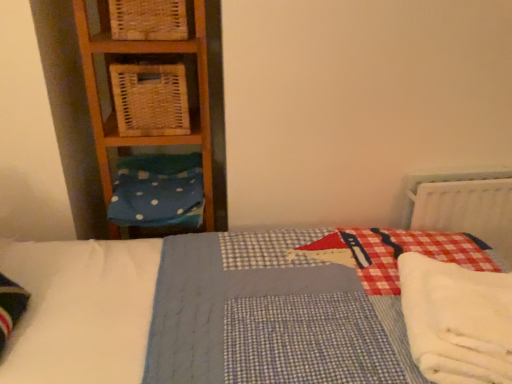
You are a GUI agent. You are given a task and a screenshot of the screen. Output one action in this format:
    pyautogui.click(x=<x>, y=<y>)
    Task: Click on the woven wood crate at upper left, acting as the 1th crate starting from the top
    
    Given the screenshot: What is the action you would take?
    pyautogui.click(x=148, y=19)

Measure the distance between woven wood crate at upper left, arranged as the 2th crate when ordered from the bottom, and camera.

woven wood crate at upper left, arranged as the 2th crate when ordered from the bottom, and camera are 4.09 feet apart from each other.

This screenshot has width=512, height=384. What are the coordinates of `blue polka dot fabric at left` in the screenshot? It's located at (157, 199).

From the image's perspective, who appears lower, blue polka dot fabric at left or woven wood basket at left, the second crate in the top-to-bottom sequence?

blue polka dot fabric at left is shown below in the image.

From a real-world perspective, which is physically above, blue polka dot fabric at left or woven wood basket at left, the second crate in the top-to-bottom sequence?

In real-world perspective, woven wood basket at left, the second crate in the top-to-bottom sequence, is above.

Between blue polka dot fabric at left and woven wood basket at left, the second crate in the top-to-bottom sequence, which one has less height?

With less height is blue polka dot fabric at left.

Do you think blue polka dot fabric at left is within woven wood basket at left, the second crate in the top-to-bottom sequence, or outside of it?

blue polka dot fabric at left is outside woven wood basket at left, the second crate in the top-to-bottom sequence.

From the picture: Does woven wood basket at left, the second crate in the top-to-bottom sequence, turn towards white fluffy blanket at lower right?

No, woven wood basket at left, the second crate in the top-to-bottom sequence, is not oriented towards white fluffy blanket at lower right.

Which is behind, point (176, 122) or point (509, 316)?

Positioned behind is point (176, 122).

Measure the distance between woven wood basket at left, the 1th crate in the bottom-to-top sequence, and white fluffy blanket at lower right.

They are 36.78 inches apart.

Between woven wood basket at left, the 1th crate in the bottom-to-top sequence, and white fluffy blanket at lower right, which one has more height?

woven wood basket at left, the 1th crate in the bottom-to-top sequence, is taller.

What are the coordinates of `material below the blue polka dot fabric at left (from the image's perspective)` in the screenshot? It's located at (457, 320).

Can you confirm if white fluffy blanket at lower right is thinner than blue polka dot fabric at left?

Indeed, white fluffy blanket at lower right has a lesser width compared to blue polka dot fabric at left.

Considering the relative positions of white fluffy blanket at lower right and blue polka dot fabric at left in the image provided, is white fluffy blanket at lower right in front of blue polka dot fabric at left?

Yes.

How different are the orientations of white fluffy blanket at lower right and blue polka dot fabric at left in degrees?

68.8 degrees separate the facing orientations of white fluffy blanket at lower right and blue polka dot fabric at left.

Is white fluffy blanket at lower right taller or shorter than woven wood crate at upper left, acting as the 1th crate starting from the top?

Clearly, white fluffy blanket at lower right is shorter compared to woven wood crate at upper left, acting as the 1th crate starting from the top.

From the picture: Would you say white fluffy blanket at lower right contains woven wood crate at upper left, arranged as the 2th crate when ordered from the bottom?

No, woven wood crate at upper left, arranged as the 2th crate when ordered from the bottom, is not a part of white fluffy blanket at lower right.

Where is `material in front of the woven wood crate at upper left, arranged as the 2th crate when ordered from the bottom`? The width and height of the screenshot is (512, 384). material in front of the woven wood crate at upper left, arranged as the 2th crate when ordered from the bottom is located at coordinates (457, 320).

Is the position of white fluffy blanket at lower right more distant than that of woven wood crate at upper left, acting as the 1th crate starting from the top?

No, white fluffy blanket at lower right is closer to the camera.

Is woven wood crate at upper left, acting as the 1th crate starting from the top, with blue polka dot fabric at left?

woven wood crate at upper left, acting as the 1th crate starting from the top, and blue polka dot fabric at left are not in contact.

Looking at their sizes, would you say woven wood crate at upper left, acting as the 1th crate starting from the top, is wider or thinner than blue polka dot fabric at left?

In the image, woven wood crate at upper left, acting as the 1th crate starting from the top, appears to be more narrow than blue polka dot fabric at left.

In the scene shown: From the image's perspective, who appears lower, white fluffy blanket at lower right or woven wood basket at left, the second crate in the top-to-bottom sequence?

white fluffy blanket at lower right, from the image's perspective.

Would you say white fluffy blanket at lower right is outside woven wood basket at left, the 1th crate in the bottom-to-top sequence?

That's correct, white fluffy blanket at lower right is outside of woven wood basket at left, the 1th crate in the bottom-to-top sequence.

Can you tell me how much white fluffy blanket at lower right and woven wood basket at left, the 1th crate in the bottom-to-top sequence, differ in facing direction?

There is a 70.4-degree angle between the facing directions of white fluffy blanket at lower right and woven wood basket at left, the 1th crate in the bottom-to-top sequence.

From a real-world perspective, which is physically above, white fluffy blanket at lower right or woven wood basket at left, the 1th crate in the bottom-to-top sequence?

woven wood basket at left, the 1th crate in the bottom-to-top sequence, from a real-world perspective.

Considering the relative positions of woven wood basket at left, the second crate in the top-to-bottom sequence, and woven wood crate at upper left, arranged as the 2th crate when ordered from the bottom, in the image provided, is woven wood basket at left, the second crate in the top-to-bottom sequence, to the left or to the right of woven wood crate at upper left, arranged as the 2th crate when ordered from the bottom,?

From the image, it's evident that woven wood basket at left, the second crate in the top-to-bottom sequence, is to the left of woven wood crate at upper left, arranged as the 2th crate when ordered from the bottom.

From a real-world perspective, between woven wood basket at left, the 1th crate in the bottom-to-top sequence, and woven wood crate at upper left, arranged as the 2th crate when ordered from the bottom, who is vertically higher?

woven wood crate at upper left, arranged as the 2th crate when ordered from the bottom, from a real-world perspective.

Is woven wood basket at left, the 1th crate in the bottom-to-top sequence, touching woven wood crate at upper left, arranged as the 2th crate when ordered from the bottom?

No, woven wood basket at left, the 1th crate in the bottom-to-top sequence, is not making contact with woven wood crate at upper left, arranged as the 2th crate when ordered from the bottom.

Which is behind, woven wood basket at left, the 1th crate in the bottom-to-top sequence, or woven wood crate at upper left, acting as the 1th crate starting from the top?

woven wood basket at left, the 1th crate in the bottom-to-top sequence, is further from the camera.

Where is `the 1st crate located above the blue polka dot fabric at left (from a real-world perspective)`? Image resolution: width=512 pixels, height=384 pixels. the 1st crate located above the blue polka dot fabric at left (from a real-world perspective) is located at coordinates (150, 99).

Find the location of a particular element. Image resolution: width=512 pixels, height=384 pixels. the 2nd crate behind the white fluffy blanket at lower right, starting your count from the anchor is located at coordinates (150, 99).

Which object lies further to the anchor point woven wood basket at left, the 1th crate in the bottom-to-top sequence, woven wood crate at upper left, acting as the 1th crate starting from the top, or blue polka dot fabric at left?

Among the two, blue polka dot fabric at left is located further to woven wood basket at left, the 1th crate in the bottom-to-top sequence.

Based on their spatial positions, is white fluffy blanket at lower right or woven wood crate at upper left, acting as the 1th crate starting from the top, further from blue polka dot fabric at left?

white fluffy blanket at lower right is positioned further to the anchor blue polka dot fabric at left.

From the image, which object appears to be nearer to white fluffy blanket at lower right, woven wood basket at left, the second crate in the top-to-bottom sequence, or blue polka dot fabric at left?

blue polka dot fabric at left lies closer to white fluffy blanket at lower right than the other object.

Based on the photo, considering their positions, is woven wood basket at left, the 1th crate in the bottom-to-top sequence, positioned further to woven wood crate at upper left, arranged as the 2th crate when ordered from the bottom, than blue polka dot fabric at left?

blue polka dot fabric at left.

Considering their positions, is woven wood crate at upper left, arranged as the 2th crate when ordered from the bottom, positioned further to white fluffy blanket at lower right than blue polka dot fabric at left?

woven wood crate at upper left, arranged as the 2th crate when ordered from the bottom, is further to white fluffy blanket at lower right.

Looking at this image, estimate the real-world distances between objects in this image. Which object is closer to blue polka dot fabric at left, white fluffy blanket at lower right or woven wood basket at left, the second crate in the top-to-bottom sequence?

The object closer to blue polka dot fabric at left is woven wood basket at left, the second crate in the top-to-bottom sequence.

Estimate the real-world distances between objects in this image. Which object is further from white fluffy blanket at lower right, blue polka dot fabric at left or woven wood crate at upper left, acting as the 1th crate starting from the top?

woven wood crate at upper left, acting as the 1th crate starting from the top, is positioned further to the anchor white fluffy blanket at lower right.

Based on their spatial positions, is white fluffy blanket at lower right or blue polka dot fabric at left further from woven wood basket at left, the second crate in the top-to-bottom sequence?

white fluffy blanket at lower right lies further to woven wood basket at left, the second crate in the top-to-bottom sequence, than the other object.

Find the location of a particular element. crate situated between woven wood basket at left, the second crate in the top-to-bottom sequence, and white fluffy blanket at lower right from left to right is located at coordinates pyautogui.click(x=148, y=19).

Identify the location of crate that lies between woven wood crate at upper left, arranged as the 2th crate when ordered from the bottom, and blue polka dot fabric at left from top to bottom. This screenshot has height=384, width=512. (150, 99).